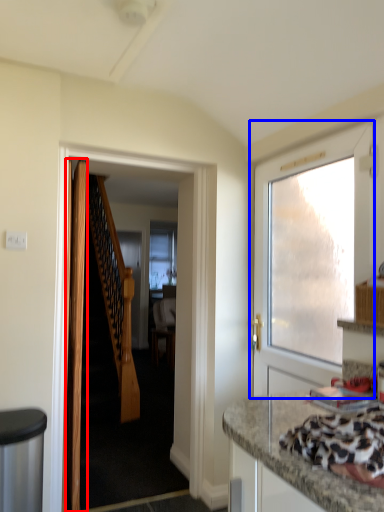
Question: Among these objects, which one is farthest to the camera, door (highlighted by a red box) or door (highlighted by a blue box)?

Choices:
 (A) door
 (B) door

Answer: (A)